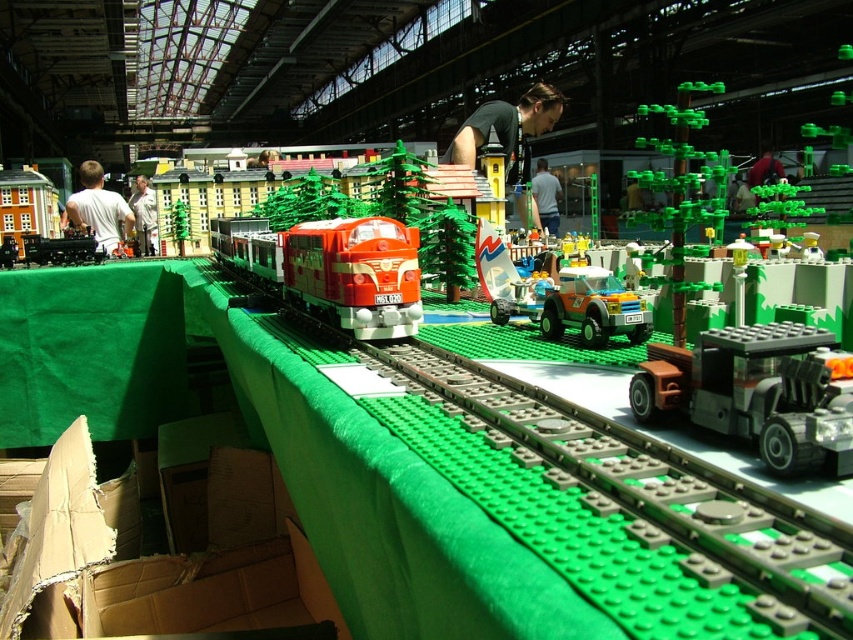
Is white t-shirt at left shorter than white shirt at left?

Yes, white t-shirt at left is shorter than white shirt at left.

Which is behind, point (117, 209) or point (151, 227)?

Point (117, 209)

This screenshot has height=640, width=853. In order to click on white t-shirt at left in this screenshot , I will do `click(99, 209)`.

Where is `matte plastic train at center`? matte plastic train at center is located at coordinates (334, 269).

Does matte plastic train at center appear on the left side of matte black figure at center?

Yes, matte plastic train at center is to the left of matte black figure at center.

Does point (363, 305) lie in front of point (769, 180)?

Yes.

Locate an element on the screen. The width and height of the screenshot is (853, 640). matte plastic train at center is located at coordinates (334, 269).

Is dark gray metallic truck at center right thinner than white shirt at center?

Indeed, dark gray metallic truck at center right has a lesser width compared to white shirt at center.

Which is above, dark gray metallic truck at center right or white shirt at center?

white shirt at center is higher up.

Is point (653, 396) more distant than point (556, 188)?

No, it is in front of (556, 188).

Where is `dark gray metallic truck at center right`? The image size is (853, 640). dark gray metallic truck at center right is located at coordinates (757, 392).